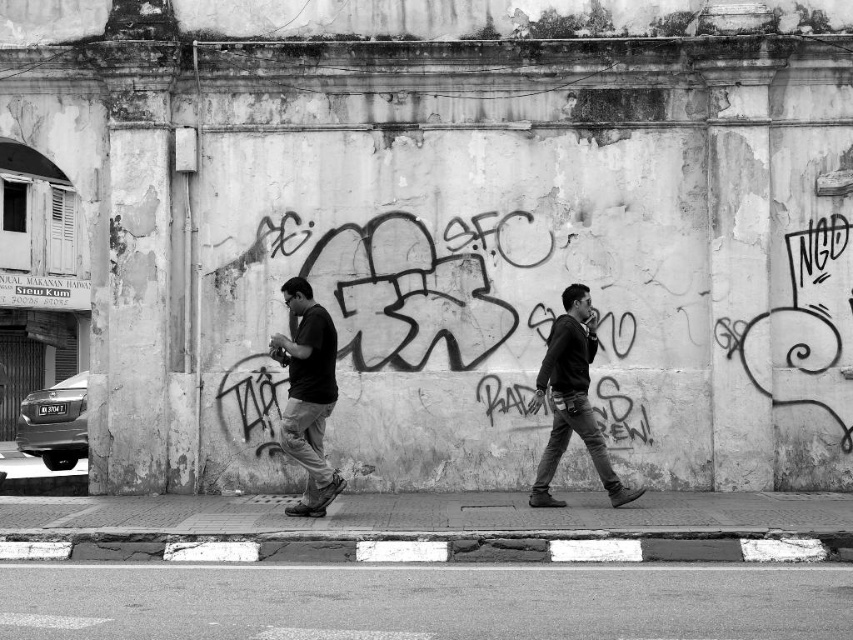
You are taking a photo of the graffiti on the wall with your camera. You notice two points marked in the image. Which point, point (x=317, y=332) or point (x=541, y=458), is closer to your camera lens?

Point (x=317, y=332) is closer to the camera lens than point (x=541, y=458).

You are a photographer trying to capture the graffiti on the wall. You notice the matte black shirt at center and the dark gray hoodie at center in your frame. Which clothing item is positioned higher in the photo?

The matte black shirt at center is positioned higher than the dark gray hoodie at center in the photo.